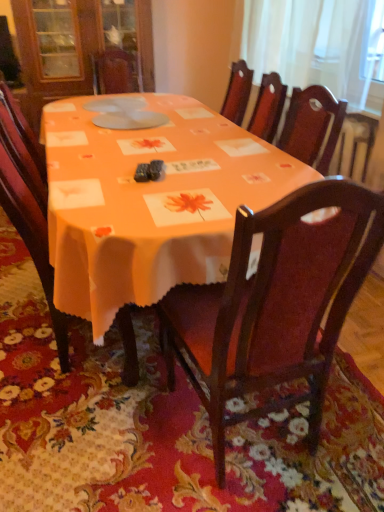
Where is `vacant space situated on the left part of wooden chair at center, the first chair when ordered from right to left`? vacant space situated on the left part of wooden chair at center, the first chair when ordered from right to left is located at coordinates (115, 441).